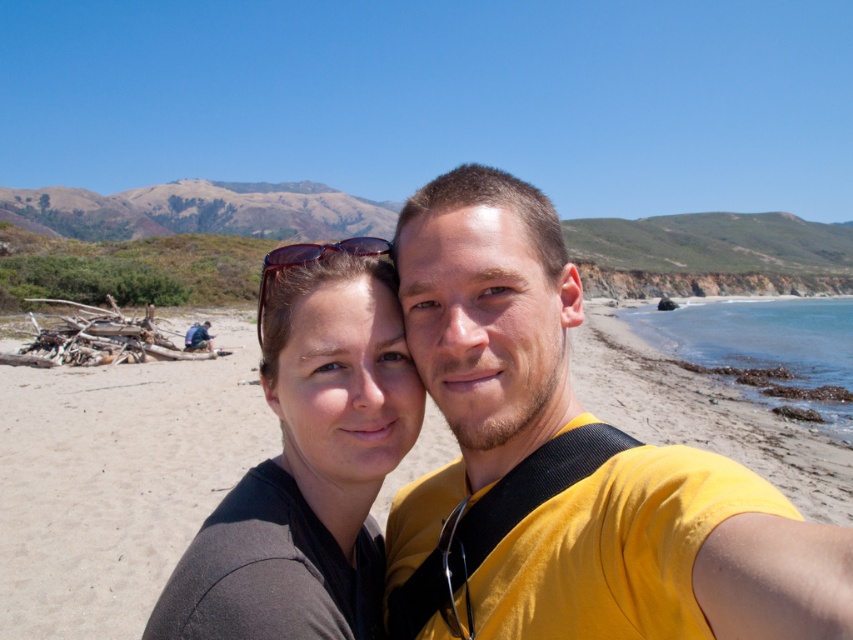
Who is taller, sandy beach at center or matte black sunglasses at center?

sandy beach at center is taller.

Can you confirm if sandy beach at center is thinner than matte black sunglasses at center?

Incorrect, sandy beach at center's width is not less than matte black sunglasses at center's.

What do you see at coordinates (119, 477) in the screenshot? Image resolution: width=853 pixels, height=640 pixels. I see `sandy beach at center` at bounding box center [119, 477].

Where is `sandy beach at center`? This screenshot has height=640, width=853. sandy beach at center is located at coordinates (119, 477).

Which is in front, point (549, 502) or point (300, 257)?

Point (549, 502)

Who is positioned more to the left, yellow matte shirt at center or matte black sunglasses at upper center?

Positioned to the left is matte black sunglasses at upper center.

Where is `yellow matte shirt at center`? This screenshot has height=640, width=853. yellow matte shirt at center is located at coordinates (567, 465).

Who is more distant from viewer, (236, 621) or (325, 250)?

The point (325, 250) is behind.

Based on the photo, between matte black sunglasses at center and matte black sunglasses at upper center, which one is positioned higher?

Positioned higher is matte black sunglasses at upper center.

Is point (357, 304) closer to viewer compared to point (267, 268)?

Yes.

Identify the location of matte black sunglasses at center. (308, 460).